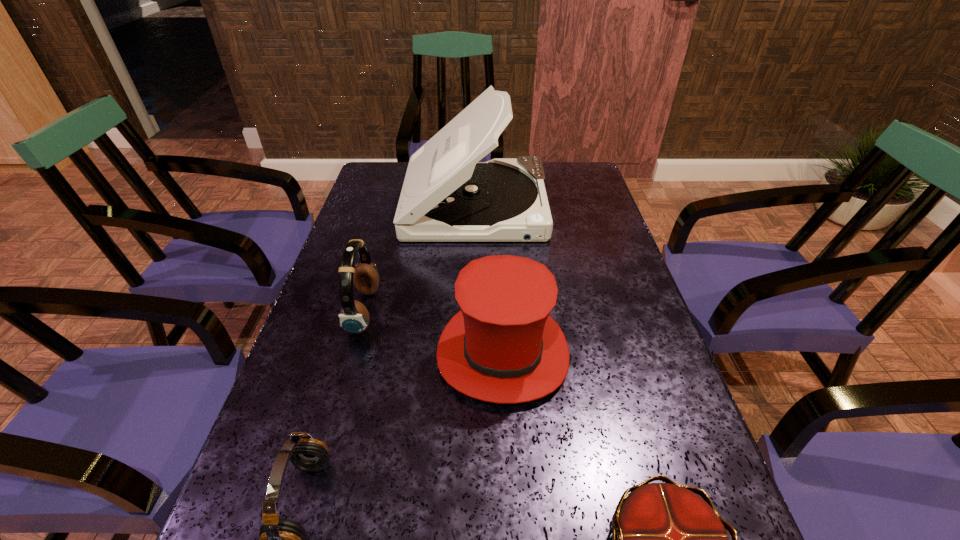
This screenshot has height=540, width=960. Identify the location of free spot that satisfies the following two spatial constraints: 1. on the control panel of the farthest object; 2. on the left side of the hat. (473, 354).

The image size is (960, 540). I want to click on vacant space that satisfies the following two spatial constraints: 1. on the control panel of the tallest object; 2. on the back side of the hat, so click(473, 354).

Locate an element on the screen. This screenshot has width=960, height=540. vacant space that satisfies the following two spatial constraints: 1. on the control panel of the farthest object; 2. on the right side of the hat is located at coordinates (473, 354).